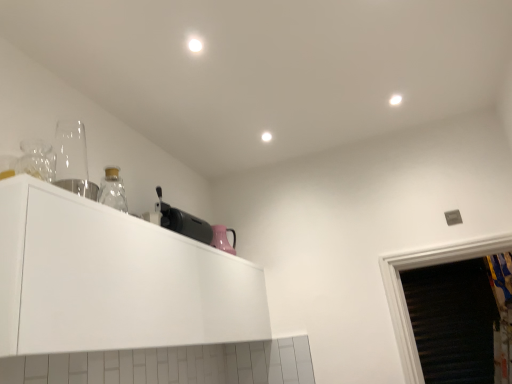
Describe the element at coordinates (113, 279) in the screenshot. The image size is (512, 384). I see `white glossy cabinet at upper left` at that location.

You are a GUI agent. You are given a task and a screenshot of the screen. Output one action in this format:
    pyautogui.click(x=<x>, y=<y>)
    Task: Click on the black plastic toaster at upper center, which is the 2th appliance in front-to-back order
    
    Given the screenshot: What is the action you would take?
    pyautogui.click(x=183, y=222)

Can you confirm if black plastic toaster at upper center, placed as the 1th appliance when sorted from bottom to top, is positioned to the right of white glossy cabinet at upper left?

Correct, you'll find black plastic toaster at upper center, placed as the 1th appliance when sorted from bottom to top, to the right of white glossy cabinet at upper left.

How different are the orientations of black plastic toaster at upper center, the 2th appliance in the left-to-right sequence, and white glossy cabinet at upper left in degrees?

0.3 degrees.

From a real-world perspective, is black plastic toaster at upper center, which is the 2th appliance in front-to-back order, above or below white glossy cabinet at upper left?

black plastic toaster at upper center, which is the 2th appliance in front-to-back order, is above white glossy cabinet at upper left.

Does point (173, 229) lie behind point (202, 251)?

Yes.

Can you tell me how much black plastic toaster at upper center, positioned as the 1th appliance in back-to-front order, and transparent glass at left, positioned as the first appliance in front-to-back order, differ in facing direction?

The angular difference between black plastic toaster at upper center, positioned as the 1th appliance in back-to-front order, and transparent glass at left, positioned as the first appliance in front-to-back order, is 6.45 degrees.

In the scene shown: Could you tell me if black plastic toaster at upper center, the first appliance from the right, is facing transparent glass at left, which is the 2th appliance from right to left?

No, black plastic toaster at upper center, the first appliance from the right, is not turned towards transparent glass at left, which is the 2th appliance from right to left.

Does point (204, 229) lie behind point (61, 151)?

Yes, point (204, 229) is behind point (61, 151).

From the image's perspective, relative to transparent glass at left, which is the second appliance from back to front, is black plastic toaster at upper center, the first appliance from the right, above or below?

black plastic toaster at upper center, the first appliance from the right, is below transparent glass at left, which is the second appliance from back to front.

Is point (26, 233) positioned in front of point (198, 220)?

Yes.

How different are the orientations of white glossy cabinet at upper left and black plastic toaster at upper center, the 2th appliance in the left-to-right sequence, in degrees?

The facing directions of white glossy cabinet at upper left and black plastic toaster at upper center, the 2th appliance in the left-to-right sequence, are 0.3 degrees apart.

Considering the relative positions of white glossy cabinet at upper left and black plastic toaster at upper center, which is the 2th appliance in front-to-back order, in the image provided, is white glossy cabinet at upper left to the right of black plastic toaster at upper center, which is the 2th appliance in front-to-back order, from the viewer's perspective?

In fact, white glossy cabinet at upper left is to the left of black plastic toaster at upper center, which is the 2th appliance in front-to-back order.

Are white glossy cabinet at upper left and black plastic toaster at upper center, the first appliance from the right, located far from each other?

A: They are positioned close to each other.

Considering the sizes of objects transparent glass at left, which is the 2th appliance from right to left, and black plastic toaster at upper center, the first appliance from the right, in the image provided, who is shorter, transparent glass at left, which is the 2th appliance from right to left, or black plastic toaster at upper center, the first appliance from the right,?

Standing shorter between the two is black plastic toaster at upper center, the first appliance from the right.

From the image's perspective, which is above, transparent glass at left, arranged as the first appliance when viewed from the top, or black plastic toaster at upper center, the first appliance from the right?

transparent glass at left, arranged as the first appliance when viewed from the top.

Choose the correct answer: Is transparent glass at left, which is the 2th appliance from right to left, inside black plastic toaster at upper center, which is the 2th appliance in front-to-back order, or outside it?

transparent glass at left, which is the 2th appliance from right to left, cannot be found inside black plastic toaster at upper center, which is the 2th appliance in front-to-back order.

Considering the relative positions of transparent glass at left, the first appliance in the left-to-right sequence, and black plastic toaster at upper center, the first appliance from the right, in the image provided, is transparent glass at left, the first appliance in the left-to-right sequence, in front of black plastic toaster at upper center, the first appliance from the right,?

That is True.

Is transparent glass at left, which is the second appliance from back to front, positioned before white glossy cabinet at upper left?

No, it is not.

Consider the image. Considering the sizes of objects transparent glass at left, arranged as the first appliance when viewed from the top, and white glossy cabinet at upper left in the image provided, who is wider, transparent glass at left, arranged as the first appliance when viewed from the top, or white glossy cabinet at upper left?

Wider between the two is white glossy cabinet at upper left.

Is white glossy cabinet at upper left completely or partially inside transparent glass at left, the first appliance in the left-to-right sequence?

No.

Based on their positions, is transparent glass at left, positioned as the first appliance in front-to-back order, located to the left or right of white glossy cabinet at upper left?

In the image, transparent glass at left, positioned as the first appliance in front-to-back order, appears on the left side of white glossy cabinet at upper left.

Choose the correct answer: Is white glossy cabinet at upper left inside transparent glass at left, which is the 2th appliance from right to left, or outside it?

white glossy cabinet at upper left is not inside transparent glass at left, which is the 2th appliance from right to left, it's outside.

In terms of height, does white glossy cabinet at upper left look taller or shorter compared to transparent glass at left, the first appliance in the left-to-right sequence?

Considering their sizes, white glossy cabinet at upper left has more height than transparent glass at left, the first appliance in the left-to-right sequence.

Could you tell me if white glossy cabinet at upper left is facing transparent glass at left, arranged as the first appliance when viewed from the top?

No, white glossy cabinet at upper left is not facing towards transparent glass at left, arranged as the first appliance when viewed from the top.

From the white glossy cabinet at upper left, count 2nd appliances backward and point to it. Please provide its 2D coordinates.

[(183, 222)]

The height and width of the screenshot is (384, 512). I want to click on appliance below the transparent glass at left, positioned as the first appliance in front-to-back order (from a real-world perspective), so click(x=183, y=222).

Looking at this image, based on their spatial positions, is black plastic toaster at upper center, placed as the 1th appliance when sorted from bottom to top, or transparent glass at left, which is the second appliance from back to front, further from white glossy cabinet at upper left?

transparent glass at left, which is the second appliance from back to front, is positioned further to the anchor white glossy cabinet at upper left.

Based on their spatial positions, is transparent glass at left, arranged as the 2th appliance when ordered from the bottom, or black plastic toaster at upper center, which is counted as the 2th appliance, starting from the top, further from white glossy cabinet at upper left?

The object further to white glossy cabinet at upper left is transparent glass at left, arranged as the 2th appliance when ordered from the bottom.

Looking at the image, which one is located further to transparent glass at left, which is the 2th appliance from right to left, white glossy cabinet at upper left or black plastic toaster at upper center, which is counted as the 2th appliance, starting from the top?

black plastic toaster at upper center, which is counted as the 2th appliance, starting from the top, lies further to transparent glass at left, which is the 2th appliance from right to left, than the other object.

Consider the image. Based on their spatial positions, is white glossy cabinet at upper left or transparent glass at left, which is the second appliance from back to front, further from black plastic toaster at upper center, positioned as the 1th appliance in back-to-front order?

The object further to black plastic toaster at upper center, positioned as the 1th appliance in back-to-front order, is transparent glass at left, which is the second appliance from back to front.

Based on their spatial positions, is black plastic toaster at upper center, the first appliance from the right, or white glossy cabinet at upper left closer to transparent glass at left, which is the 2th appliance from right to left?

white glossy cabinet at upper left is closer to transparent glass at left, which is the 2th appliance from right to left.

When comparing their distances from black plastic toaster at upper center, positioned as the 1th appliance in back-to-front order, does transparent glass at left, the first appliance in the left-to-right sequence, or white glossy cabinet at upper left seem further?

Among the two, transparent glass at left, the first appliance in the left-to-right sequence, is located further to black plastic toaster at upper center, positioned as the 1th appliance in back-to-front order.

The image size is (512, 384). Find the location of `appliance between white glossy cabinet at upper left and black plastic toaster at upper center, positioned as the 1th appliance in back-to-front order, in the front-back direction`. appliance between white glossy cabinet at upper left and black plastic toaster at upper center, positioned as the 1th appliance in back-to-front order, in the front-back direction is located at coordinates (73, 160).